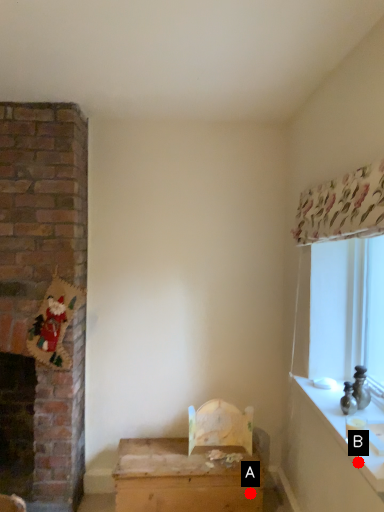
Question: Two points are circled on the image, labeled by A and B beside each circle. Which of the following is the closest to the observer?

Choices:
 (A) A is closer
 (B) B is closer

Answer: (B)